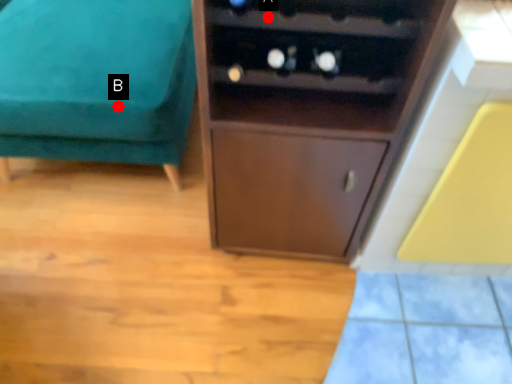
Question: Two points are circled on the image, labeled by A and B beside each circle. Which point appears closest to the camera in this image?

Choices:
 (A) A is closer
 (B) B is closer

Answer: (A)